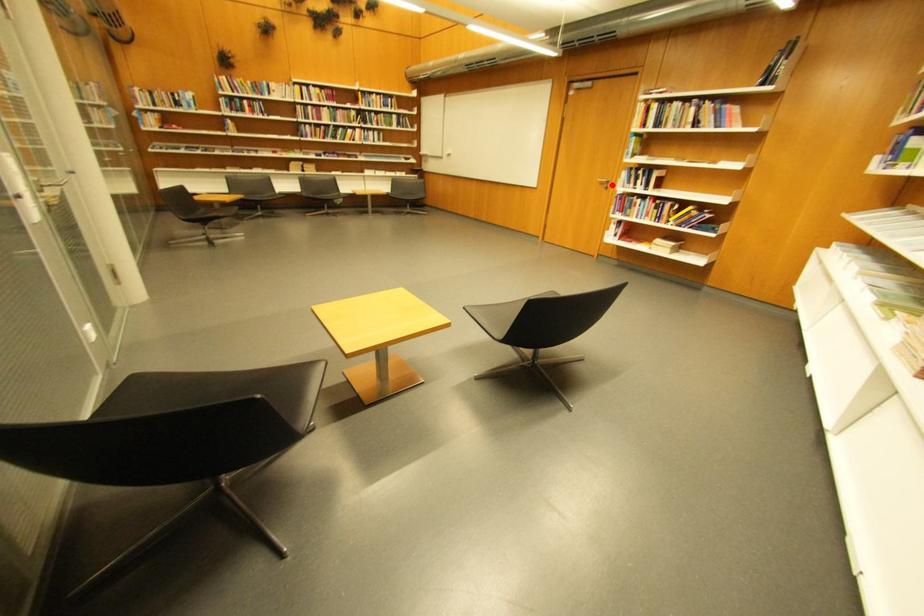
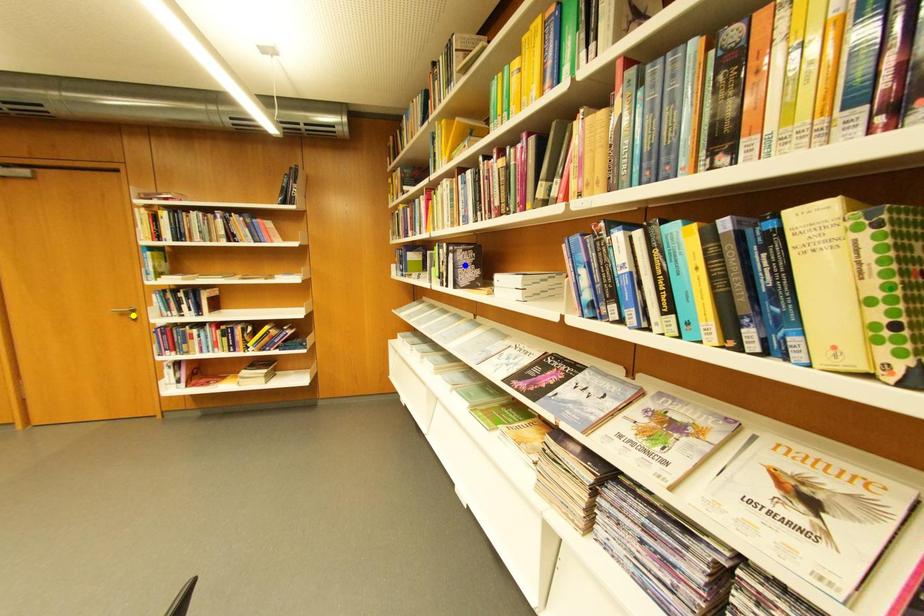
Question: I am providing you with two images of the same scene from different viewpoints. A red point is marked on the first image. You are given multiple points on the second image. Which point in image 2 represents the same 3d spot as the red point in image 1?

Choices:
 (A) green point
 (B) yellow point
 (C) blue point

Answer: (B)